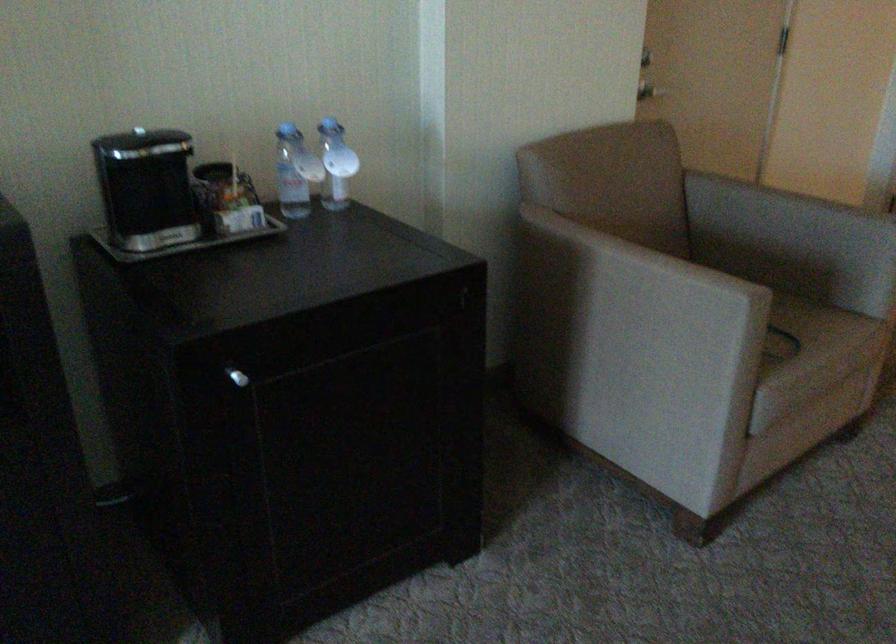
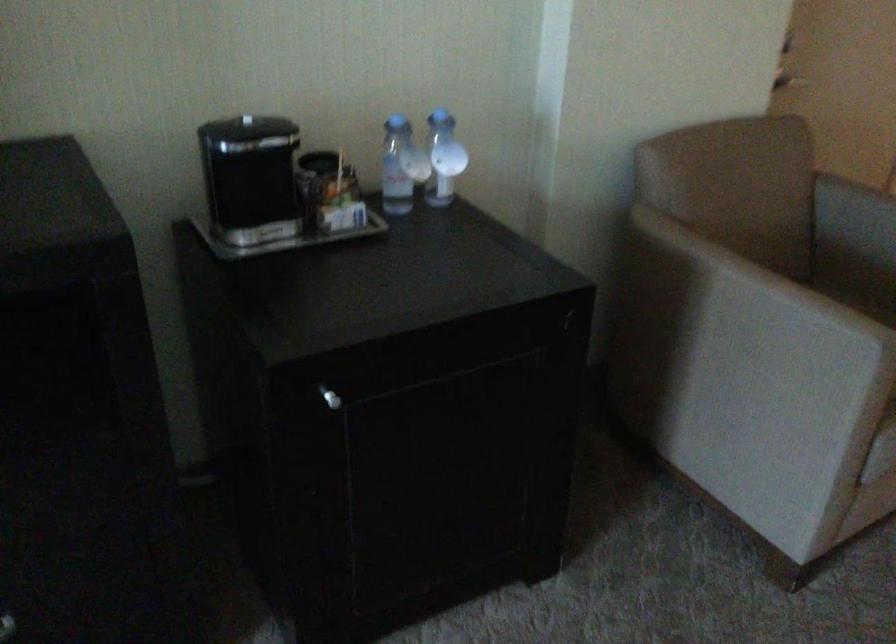
The point at (x=237, y=377) is marked in the first image. Where is the corresponding point in the second image?

(330, 398)